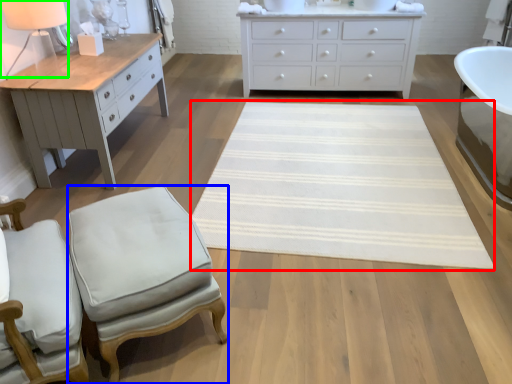
Question: Considering the real-world distances, which object is closest to mat (highlighted by a red box)? stool (highlighted by a blue box) or table lamp (highlighted by a green box).

Choices:
 (A) stool
 (B) table lamp

Answer: (A)